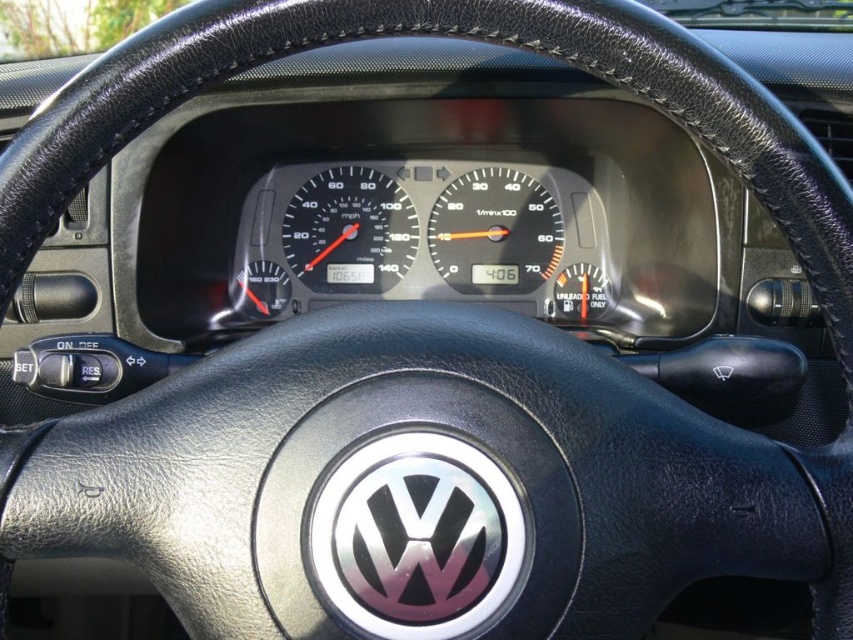
Is point (315, 228) farther from camera compared to point (463, 291)?

No, it is in front of (463, 291).

The width and height of the screenshot is (853, 640). What do you see at coordinates (349, 230) in the screenshot?
I see `black glass speedometer at center` at bounding box center [349, 230].

Is point (302, 241) behind point (541, 259)?

No, it is in front of (541, 259).

This screenshot has width=853, height=640. I want to click on black glass speedometer at center, so (349, 230).